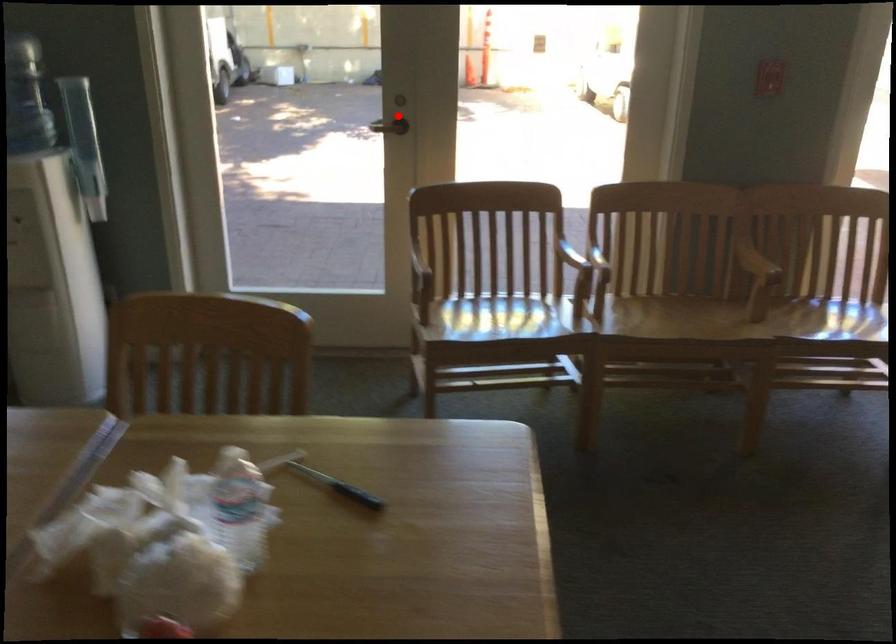
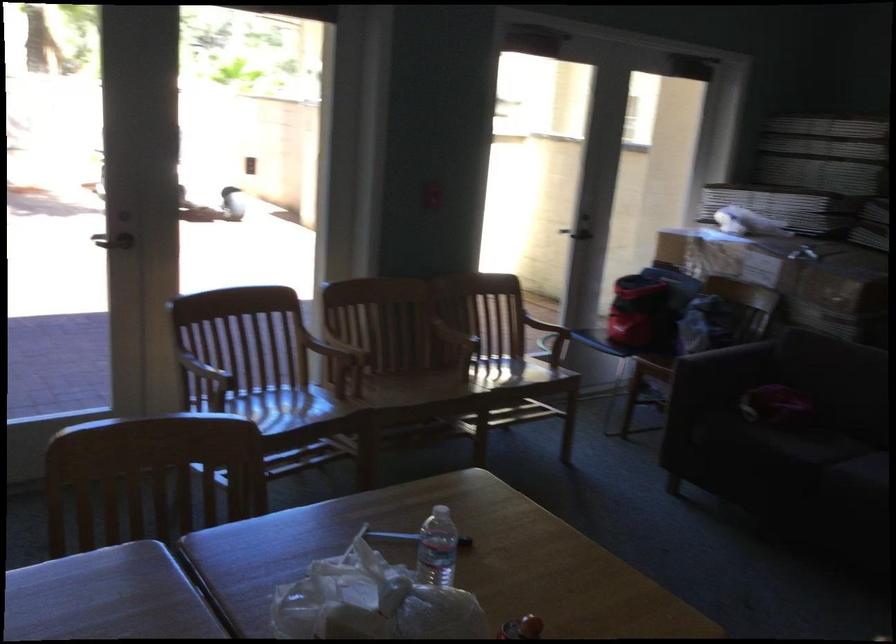
Find the pixel in the second image that matches the highlighted location in the first image.

(113, 241)